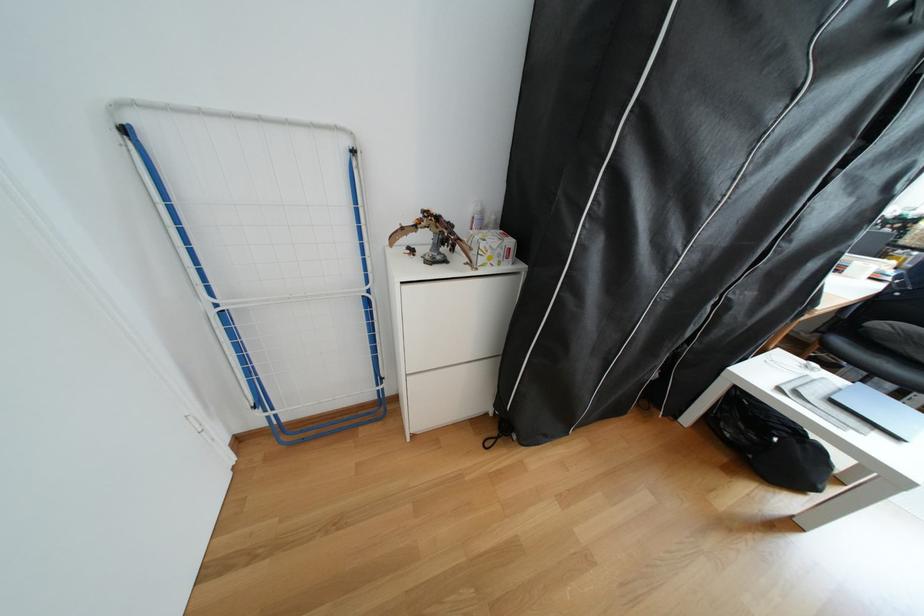
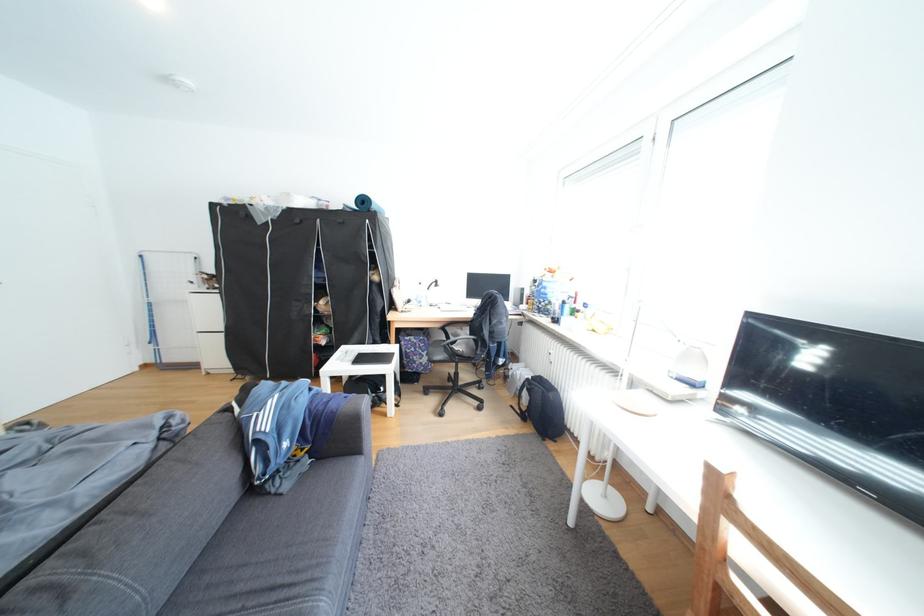
Question: In a continuous first-person perspective shot, in which direction is the camera moving?

Choices:
 (A) Left
 (B) Right
 (C) Forward
 (D) Backward

Answer: (B)